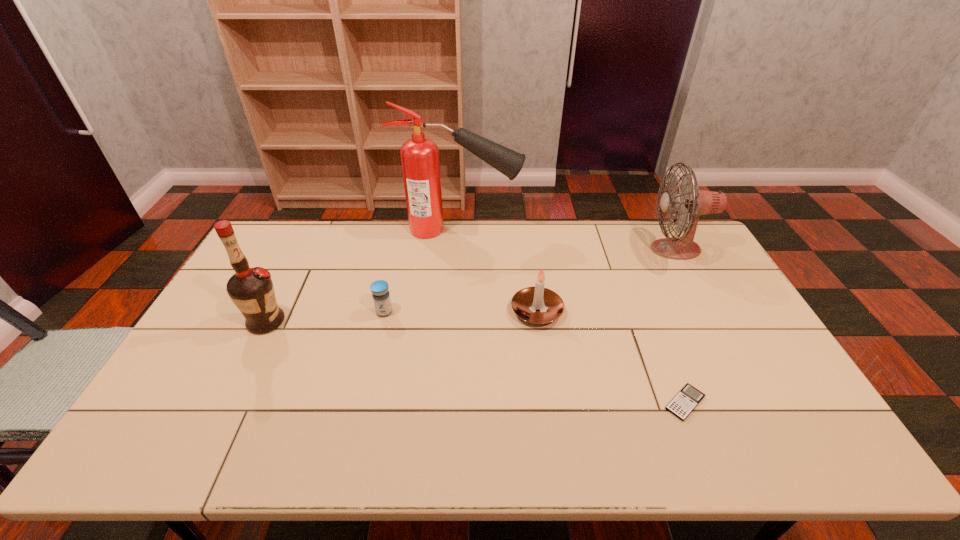
At what (x,y) coordinates should I click in order to perform the action: click on vacant area that satisfies the following two spatial constraints: 1. at the nozzle of the fire extinguisher; 2. on the right side of the nearest object. Please return your answer as a coordinate pair (x, y). The image size is (960, 540). Looking at the image, I should click on (448, 403).

Identify the location of free point that satisfies the following two spatial constraints: 1. on the front side of the shortest object; 2. on the right side of the candle. (549, 403).

Find the location of a particular element. free space that satisfies the following two spatial constraints: 1. on the back side of the fifth object from left to right; 2. at the nozzle of the fire extinguisher is located at coordinates (615, 230).